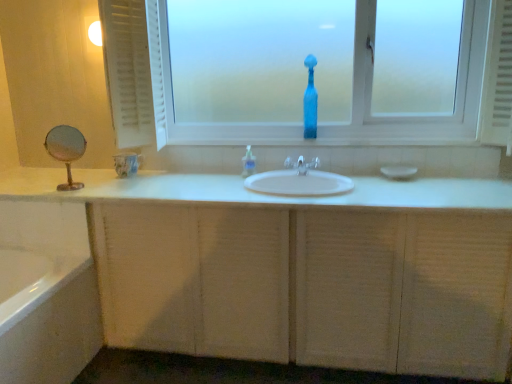
Question: Is transparent glass bottle at center closer to camera compared to translucent plastic soap dispenser at center?

Choices:
 (A) no
 (B) yes

Answer: (B)

Question: Could you tell me if transparent glass bottle at center is facing translucent plastic soap dispenser at center?

Choices:
 (A) no
 (B) yes

Answer: (A)

Question: Would you say transparent glass bottle at center is a long distance from translucent plastic soap dispenser at center?

Choices:
 (A) yes
 (B) no

Answer: (B)

Question: Can you confirm if transparent glass bottle at center is wider than translucent plastic soap dispenser at center?

Choices:
 (A) no
 (B) yes

Answer: (B)

Question: Does transparent glass bottle at center have a lesser height compared to translucent plastic soap dispenser at center?

Choices:
 (A) yes
 (B) no

Answer: (B)

Question: Is transparent glass bottle at center next to translucent plastic soap dispenser at center?

Choices:
 (A) no
 (B) yes

Answer: (A)

Question: Would you consider white textured cabinet at center to be distant from transparent glass bottle at center?

Choices:
 (A) yes
 (B) no

Answer: (B)

Question: Does white textured cabinet at center come in front of transparent glass bottle at center?

Choices:
 (A) no
 (B) yes

Answer: (B)

Question: Does white textured cabinet at center appear on the right side of transparent glass bottle at center?

Choices:
 (A) no
 (B) yes

Answer: (B)

Question: Is white textured cabinet at center turned away from transparent glass bottle at center?

Choices:
 (A) no
 (B) yes

Answer: (A)

Question: Is white textured cabinet at center with transparent glass bottle at center?

Choices:
 (A) yes
 (B) no

Answer: (B)

Question: From the image's perspective, would you say white textured cabinet at center is shown under transparent glass bottle at center?

Choices:
 (A) yes
 (B) no

Answer: (A)

Question: Is clear plastic faucet at center closer to camera compared to white textured radiator at right?

Choices:
 (A) yes
 (B) no

Answer: (B)